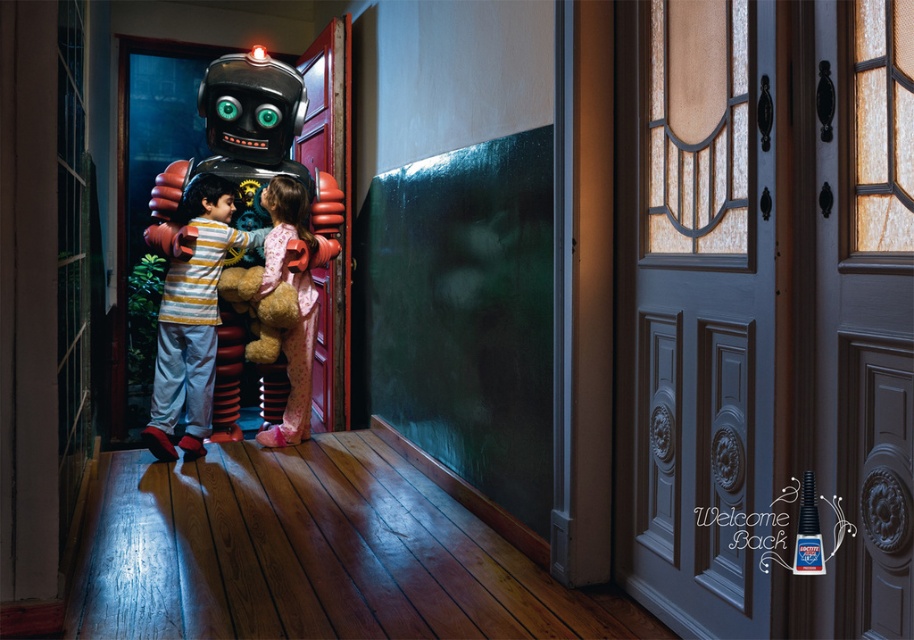
Question: Which point is farther from the camera taking this photo?

Choices:
 (A) (247, 342)
 (B) (300, 330)
 (C) (321, 212)

Answer: (C)

Question: Which point is farther from the camera taking this photo?

Choices:
 (A) (205, 308)
 (B) (252, 134)

Answer: (B)

Question: Which of the following is the farthest from the observer?

Choices:
 (A) soft plush teddy bear at center
 (B) pink satin pajamas at center
 (C) shiny metallic robot at center

Answer: (B)

Question: Is shiny metallic robot at center behind soft plush teddy bear at center?

Choices:
 (A) yes
 (B) no

Answer: (B)

Question: Can you confirm if shiny metallic robot at center is smaller than pink satin pajamas at center?

Choices:
 (A) yes
 (B) no

Answer: (B)

Question: Is pink satin pajamas at center above soft plush teddy bear at center?

Choices:
 (A) yes
 (B) no

Answer: (B)